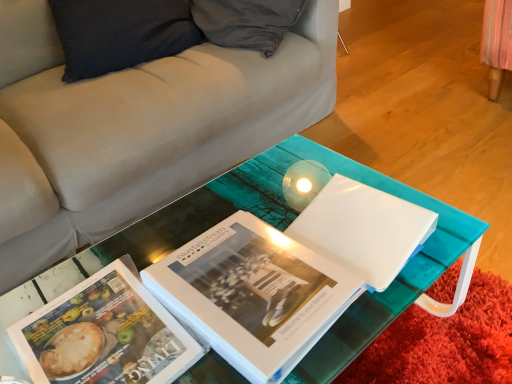
Question: Is matte paper book at center, which is counted as the 2th book, starting from the right, not near white glossy book at center, arranged as the 1th book when viewed from the right?

Choices:
 (A) no
 (B) yes

Answer: (A)

Question: Is matte paper book at center, which is the 1th book from left to right, placed right next to white glossy book at center, arranged as the 1th book when viewed from the right?

Choices:
 (A) yes
 (B) no

Answer: (B)

Question: From the image's perspective, does matte paper book at center, which is counted as the 2th book, starting from the right, appear higher than white glossy book at center, arranged as the 1th book when viewed from the right?

Choices:
 (A) yes
 (B) no

Answer: (B)

Question: Is matte paper book at center, which is counted as the 2th book, starting from the right, to the right of white glossy book at center, arranged as the 1th book when viewed from the right, from the viewer's perspective?

Choices:
 (A) no
 (B) yes

Answer: (A)

Question: Could you tell me if matte paper book at center, which is counted as the 2th book, starting from the right, is turned towards white glossy book at center, arranged as the 2th book when viewed from the left?

Choices:
 (A) yes
 (B) no

Answer: (B)

Question: Considering the positions of white glossy folder at center and matte paper book at center, which is counted as the 2th book, starting from the right, in the image, is white glossy folder at center wider or thinner than matte paper book at center, which is counted as the 2th book, starting from the right,?

Choices:
 (A) wide
 (B) thin

Answer: (B)

Question: Is white glossy folder at center bigger or smaller than matte paper book at center, which is counted as the 2th book, starting from the right?

Choices:
 (A) big
 (B) small

Answer: (A)

Question: Considering the positions of white glossy folder at center and matte paper book at center, which is the 1th book from left to right, in the image, is white glossy folder at center taller or shorter than matte paper book at center, which is the 1th book from left to right,?

Choices:
 (A) tall
 (B) short

Answer: (A)

Question: Relative to matte paper book at center, which is the 1th book from left to right, is white glossy folder at center in front or behind?

Choices:
 (A) behind
 (B) front

Answer: (A)

Question: Is point (193, 324) positioned closer to the camera than point (104, 362)?

Choices:
 (A) farther
 (B) closer

Answer: (A)

Question: Is white glossy book at center, arranged as the 2th book when viewed from the left, wider or thinner than matte paper book at center, which is the 1th book from left to right?

Choices:
 (A) wide
 (B) thin

Answer: (A)

Question: In terms of size, does white glossy book at center, arranged as the 1th book when viewed from the right, appear bigger or smaller than matte paper book at center, which is counted as the 2th book, starting from the right?

Choices:
 (A) big
 (B) small

Answer: (A)

Question: From their relative heights in the image, would you say white glossy book at center, arranged as the 1th book when viewed from the right, is taller or shorter than matte paper book at center, which is counted as the 2th book, starting from the right?

Choices:
 (A) short
 (B) tall

Answer: (B)

Question: Looking at their shapes, would you say matte paper book at center, which is the 1th book from left to right, is wider or thinner than white glossy folder at center?

Choices:
 (A) wide
 (B) thin

Answer: (A)

Question: Considering their positions, is matte paper book at center, which is the 1th book from left to right, located in front of or behind white glossy folder at center?

Choices:
 (A) front
 (B) behind

Answer: (A)